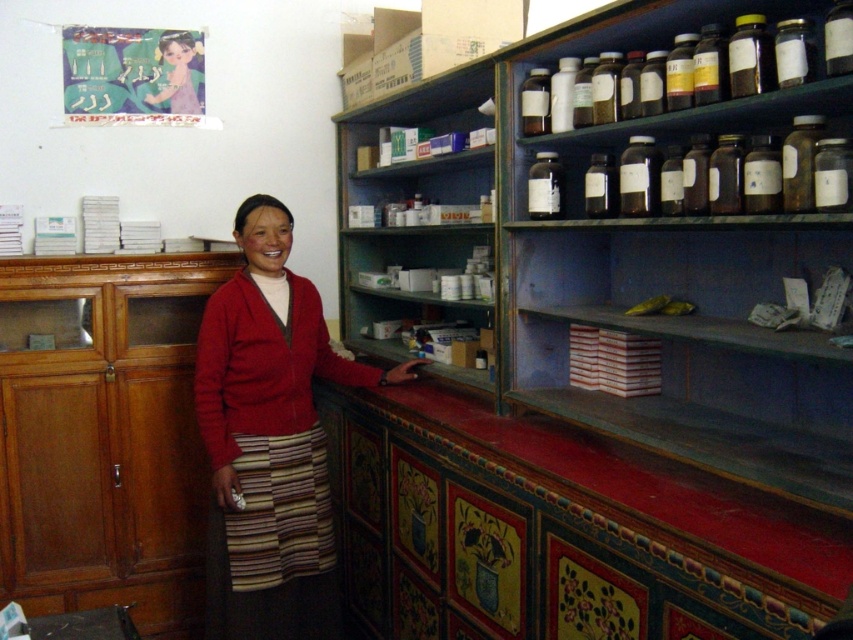
Between point (256, 624) and point (805, 12), which one is positioned behind?

The point (256, 624) is more distant.

Between red sweater at center and translucent glass bottles at upper right, which one appears on the left side from the viewer's perspective?

red sweater at center is more to the left.

The image size is (853, 640). Find the location of `red sweater at center`. red sweater at center is located at coordinates (270, 440).

Is red sweater at center below matte purple dress at upper left?

Yes.

Which is above, red sweater at center or matte purple dress at upper left?

matte purple dress at upper left is higher up.

Which is in front, point (312, 534) or point (193, 45)?

Positioned in front is point (312, 534).

The height and width of the screenshot is (640, 853). I want to click on red sweater at center, so click(x=270, y=440).

Can you confirm if green painted wood shelves at center is positioned below matte purple dress at upper left?

Correct, green painted wood shelves at center is located below matte purple dress at upper left.

Who is more forward, (410,173) or (170,93)?

Positioned in front is point (170,93).

What do you see at coordinates (407, 204) in the screenshot?
I see `green painted wood shelves at center` at bounding box center [407, 204].

Identify the location of green painted wood shelves at center. (407, 204).